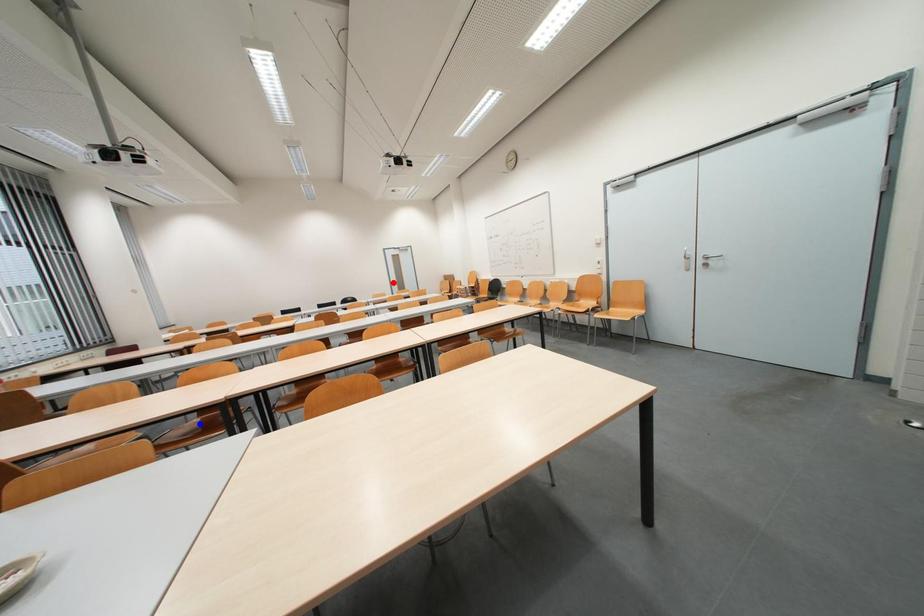
Question: Which of the two points in the image is closer to the camera?

Choices:
 (A) Blue point is closer.
 (B) Red point is closer.

Answer: (A)